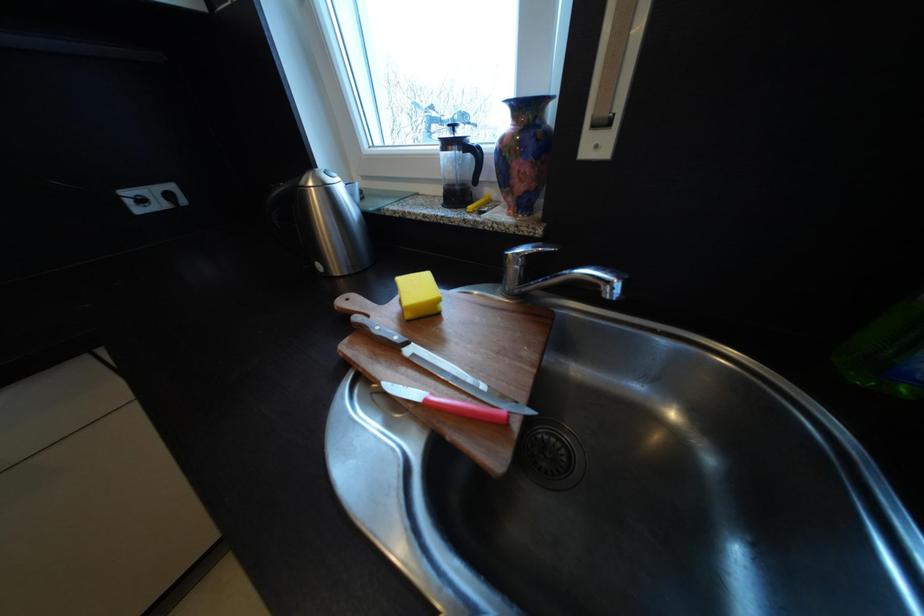
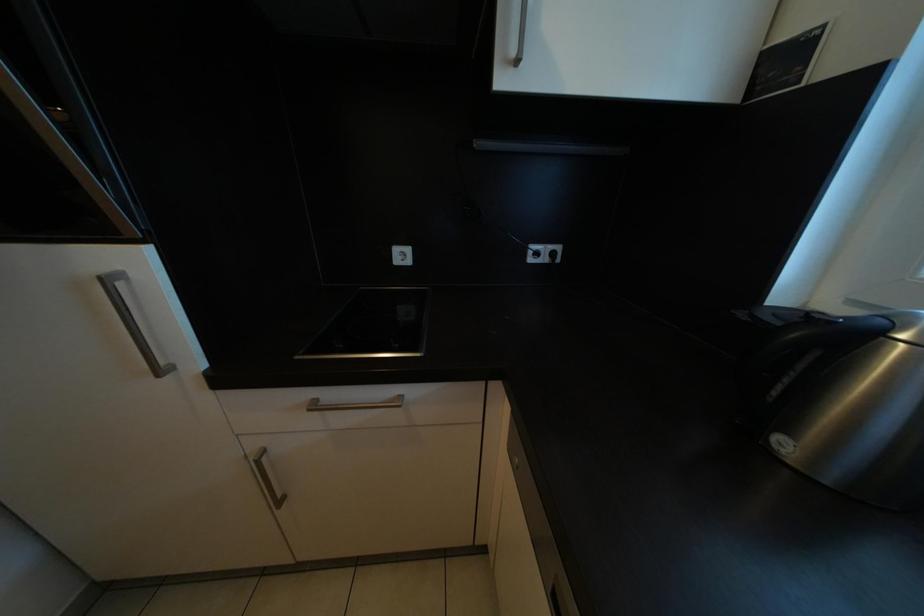
Question: The images are taken continuously from a first-person perspective. In which direction is your viewpoint rotating?

Choices:
 (A) Left
 (B) Right
 (C) Up
 (D) Down

Answer: (A)